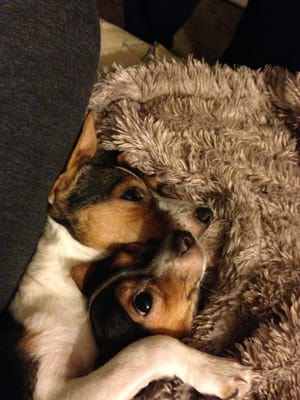
Image resolution: width=300 pixels, height=400 pixels. I want to click on rug, so click(x=236, y=186).